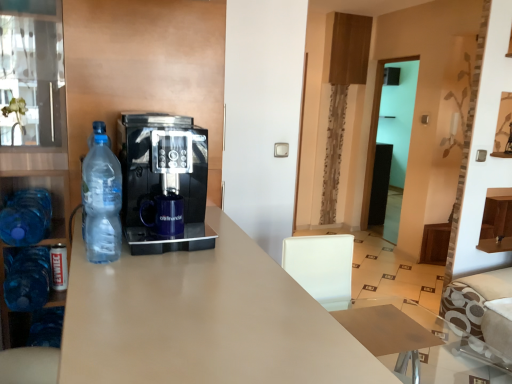
What are the coordinates of `vacant area that lies in front of clear plastic bottle at left, the third bottle from the bottom` in the screenshot? It's located at (105, 281).